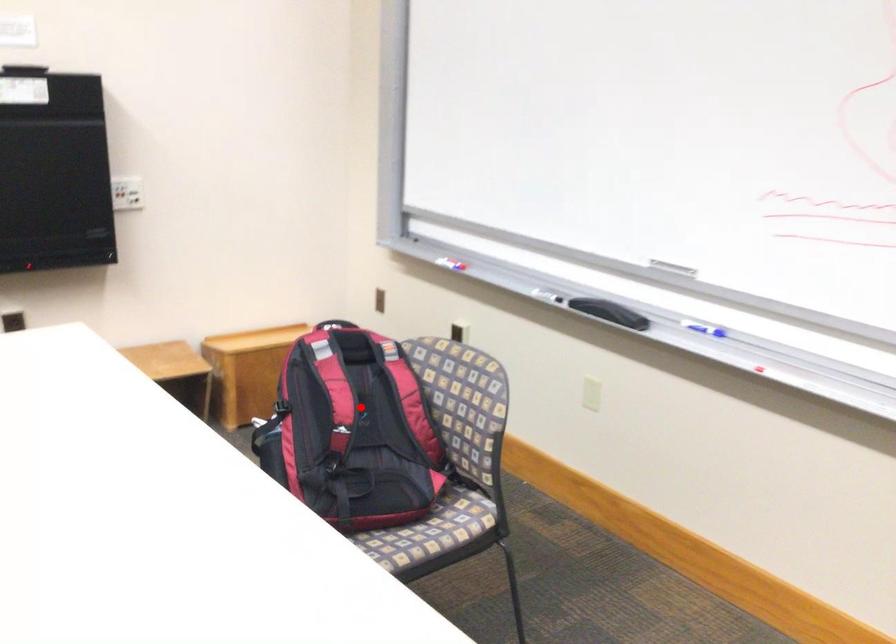
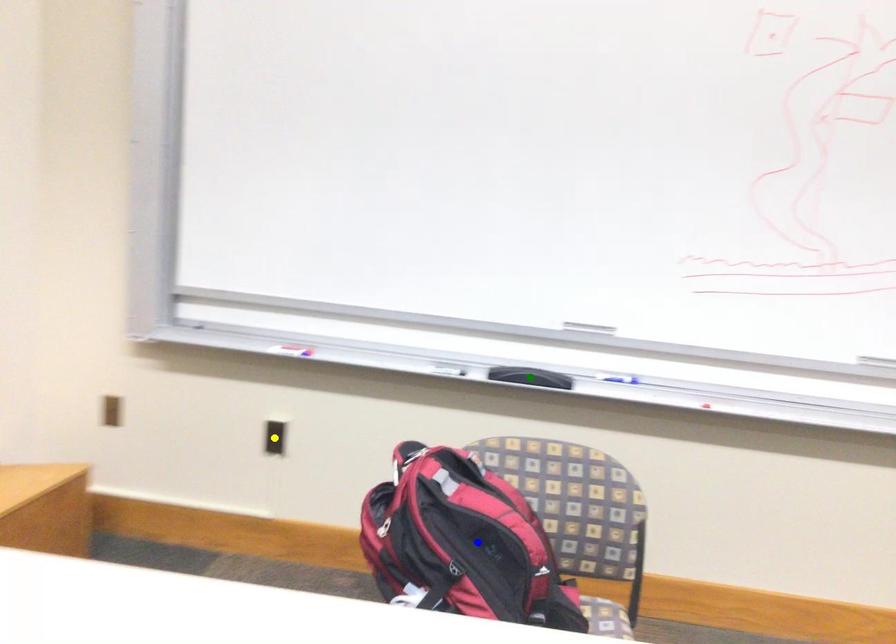
Question: I am providing you with two images of the same scene from different viewpoints. A red point is marked on the first image. You are given multiple points on the second image. Can you choose the point in image 2 that corresponds to the point in image 1?

Choices:
 (A) yellow point
 (B) blue point
 (C) green point

Answer: (B)